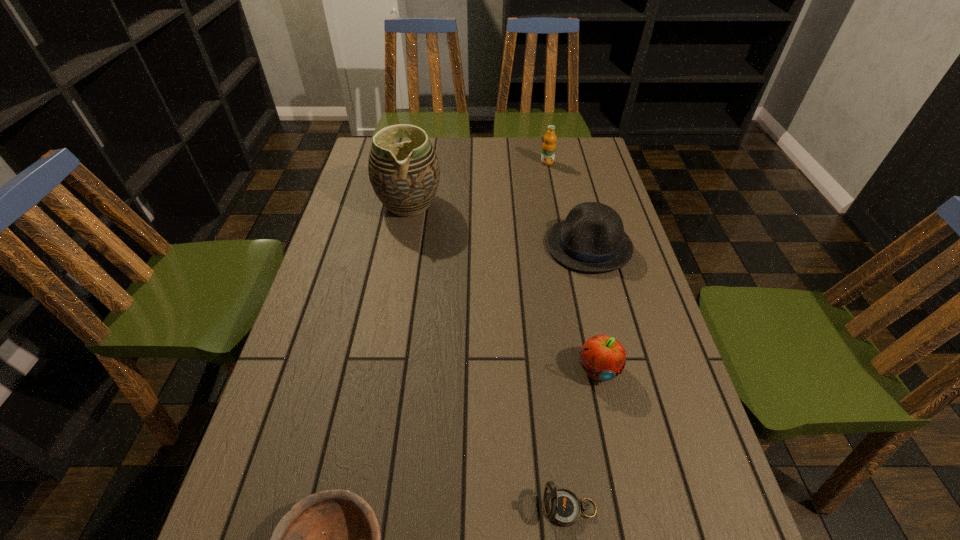
Where is `object identified as the fourth closest to the bowl`? object identified as the fourth closest to the bowl is located at coordinates (405, 176).

Find the location of `vacant space that satisfies the following two spatial constraints: 1. on the label of the orange juice; 2. on the face of the compass`. vacant space that satisfies the following two spatial constraints: 1. on the label of the orange juice; 2. on the face of the compass is located at coordinates (615, 508).